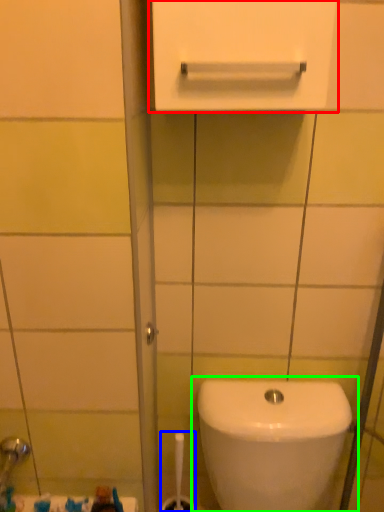
Question: Estimate the real-world distances between objects in this image. Which object is farther from medicine cabinet (highlighted by a red box), brush (highlighted by a blue box) or toilet (highlighted by a green box)?

Choices:
 (A) brush
 (B) toilet

Answer: (A)